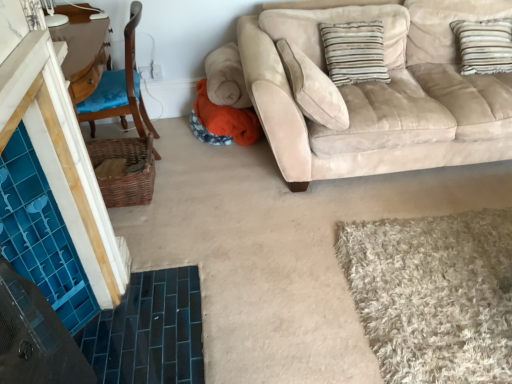
Describe the element at coordinates (124, 170) in the screenshot. I see `woven brown basket at left` at that location.

This screenshot has height=384, width=512. I want to click on blue fabric chair at left, so click(113, 86).

Locate an element on the screen. This screenshot has width=512, height=384. beige shaggy rug at lower right is located at coordinates (434, 294).

At what (x,y) coordinates should I click in order to perform the action: click on suede beige couch at upper right. Please return your answer as a coordinate pair (x, y). Looking at the image, I should click on (380, 91).

Is the position of woven brown basket at left less distant than that of beige shaggy rug at lower right?

That is False.

From a real-world perspective, does woven brown basket at left stand above beige shaggy rug at lower right?

Indeed, from a real-world perspective, woven brown basket at left stands above beige shaggy rug at lower right.

Do you think woven brown basket at left is within beige shaggy rug at lower right, or outside of it?

woven brown basket at left cannot be found inside beige shaggy rug at lower right.

From a real-world perspective, who is located lower, suede beige couch at upper right or striped fabric pillow at upper right?

In real-world perspective, suede beige couch at upper right is lower.

Relative to striped fabric pillow at upper right, is suede beige couch at upper right in front or behind?

In the image, suede beige couch at upper right appears in front of striped fabric pillow at upper right.

Does suede beige couch at upper right have a greater width compared to striped fabric pillow at upper right?

Yes.

Considering the points (421, 12) and (380, 27), which point is behind, point (421, 12) or point (380, 27)?

Point (421, 12)

Is beige shaggy rug at lower right inside or outside of woven brown basket at left?

beige shaggy rug at lower right is outside woven brown basket at left.

From a real-world perspective, is beige shaggy rug at lower right physically located above or below woven brown basket at left?

beige shaggy rug at lower right is below woven brown basket at left.

Considering the positions of objects beige shaggy rug at lower right and woven brown basket at left in the image provided, who is behind, beige shaggy rug at lower right or woven brown basket at left?

woven brown basket at left is behind.

From the image's perspective, does beige shaggy rug at lower right appear lower than woven brown basket at left?

Indeed, from the image's perspective, beige shaggy rug at lower right is shown beneath woven brown basket at left.

Considering the sizes of objects striped fabric pillow at upper right and blue fabric chair at left in the image provided, who is wider, striped fabric pillow at upper right or blue fabric chair at left?

With larger width is blue fabric chair at left.

Can you tell me how much striped fabric pillow at upper right and blue fabric chair at left differ in facing direction?

The angular difference between striped fabric pillow at upper right and blue fabric chair at left is 85.4 degrees.

Is striped fabric pillow at upper right further to the viewer compared to blue fabric chair at left?

Yes, the depth of striped fabric pillow at upper right is greater than that of blue fabric chair at left.

Considering the relative positions of striped fabric pillow at upper right and blue fabric chair at left in the image provided, is striped fabric pillow at upper right to the left or to the right of blue fabric chair at left?

From the image, it's evident that striped fabric pillow at upper right is to the right of blue fabric chair at left.

Is point (343, 83) in front of point (340, 88)?

No, it is not.

Which object is wider, striped fabric pillow at upper right or suede beige couch at upper right?

Wider between the two is suede beige couch at upper right.

From a real-world perspective, is suede beige couch at upper right positioned above or below beige shaggy rug at lower right?

From a real-world perspective, suede beige couch at upper right is physically above beige shaggy rug at lower right.

From the image's perspective, which one is positioned higher, suede beige couch at upper right or beige shaggy rug at lower right?

suede beige couch at upper right.

Is suede beige couch at upper right not inside beige shaggy rug at lower right?

suede beige couch at upper right is positioned outside beige shaggy rug at lower right.

How many degrees apart are the facing directions of suede beige couch at upper right and beige shaggy rug at lower right?

92.5 degrees separate the facing orientations of suede beige couch at upper right and beige shaggy rug at lower right.

At what (x,y) coordinates should I click in order to perform the action: click on bath mat that appears in front of the striped fabric pillow at upper right. Please return your answer as a coordinate pair (x, y). Looking at the image, I should click on (434, 294).

Is striped fabric pillow at upper right oriented away from beige shaggy rug at lower right?

striped fabric pillow at upper right does not have its back to beige shaggy rug at lower right.

Considering the sizes of objects striped fabric pillow at upper right and beige shaggy rug at lower right in the image provided, who is thinner, striped fabric pillow at upper right or beige shaggy rug at lower right?

striped fabric pillow at upper right.

In the scene shown: Between striped fabric pillow at upper right and beige shaggy rug at lower right, which one is positioned in front?

beige shaggy rug at lower right is more forward.

The image size is (512, 384). Identify the location of basket on the left of the beige shaggy rug at lower right. click(124, 170).

Where is `studio couch that appears on the right of striped fabric pillow at upper right`? This screenshot has height=384, width=512. studio couch that appears on the right of striped fabric pillow at upper right is located at coordinates (380, 91).

Based on their spatial positions, is suede beige couch at upper right or striped fabric pillow at upper right further from beige shaggy rug at lower right?

The object further to beige shaggy rug at lower right is striped fabric pillow at upper right.

Considering their positions, is suede beige couch at upper right positioned further to blue fabric chair at left than beige shaggy rug at lower right?

Based on the image, beige shaggy rug at lower right appears to be further to blue fabric chair at left.

Considering their positions, is woven brown basket at left positioned further to beige shaggy rug at lower right than striped fabric pillow at upper right?

woven brown basket at left is positioned further to the anchor beige shaggy rug at lower right.

Looking at the image, which one is located closer to woven brown basket at left, blue fabric chair at left or striped fabric pillow at upper right?

blue fabric chair at left lies closer to woven brown basket at left than the other object.

Based on their spatial positions, is blue fabric chair at left or striped fabric pillow at upper right closer to suede beige couch at upper right?

Based on the image, striped fabric pillow at upper right appears to be nearer to suede beige couch at upper right.

Estimate the real-world distances between objects in this image. Which object is closer to beige shaggy rug at lower right, woven brown basket at left or suede beige couch at upper right?

The object closer to beige shaggy rug at lower right is suede beige couch at upper right.

Considering their positions, is suede beige couch at upper right positioned closer to striped fabric pillow at upper right than blue fabric chair at left?

suede beige couch at upper right.

When comparing their distances from blue fabric chair at left, does woven brown basket at left or suede beige couch at upper right seem closer?

woven brown basket at left is positioned closer to the anchor blue fabric chair at left.

The image size is (512, 384). Find the location of `basket between blue fabric chair at left and suede beige couch at upper right in the horizontal direction`. basket between blue fabric chair at left and suede beige couch at upper right in the horizontal direction is located at coordinates (124, 170).

I want to click on basket situated between blue fabric chair at left and beige shaggy rug at lower right from left to right, so click(124, 170).

At what (x,y) coordinates should I click in order to perform the action: click on bath mat located between blue fabric chair at left and suede beige couch at upper right in the left-right direction. Please return your answer as a coordinate pair (x, y). This screenshot has height=384, width=512. Looking at the image, I should click on (434, 294).

Image resolution: width=512 pixels, height=384 pixels. In order to click on basket between blue fabric chair at left and striped fabric pillow at upper right from left to right in this screenshot , I will do `click(124, 170)`.